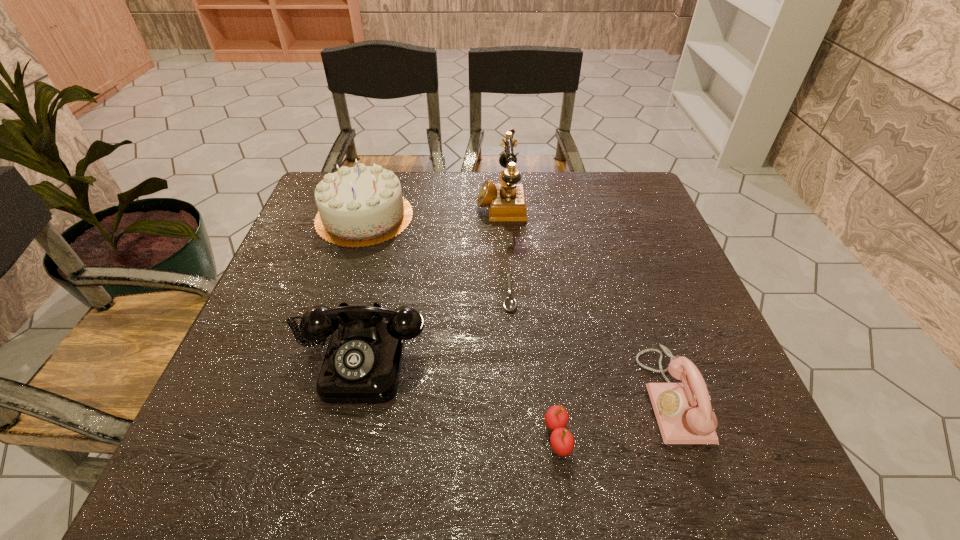
Identify the location of blank space that satisfies the following two spatial constraints: 1. on the dial number of the tallest telephone; 2. on the dial of the leftmost telephone. (510, 357).

The height and width of the screenshot is (540, 960). I want to click on vacant area that satisfies the following two spatial constraints: 1. on the back side of the second shortest object; 2. on the dial number of the farthest telephone, so click(526, 202).

Locate an element on the screen. The width and height of the screenshot is (960, 540). vacant space that satisfies the following two spatial constraints: 1. on the dial number of the second telephone from left to right; 2. on the dial of the leftmost telephone is located at coordinates (510, 357).